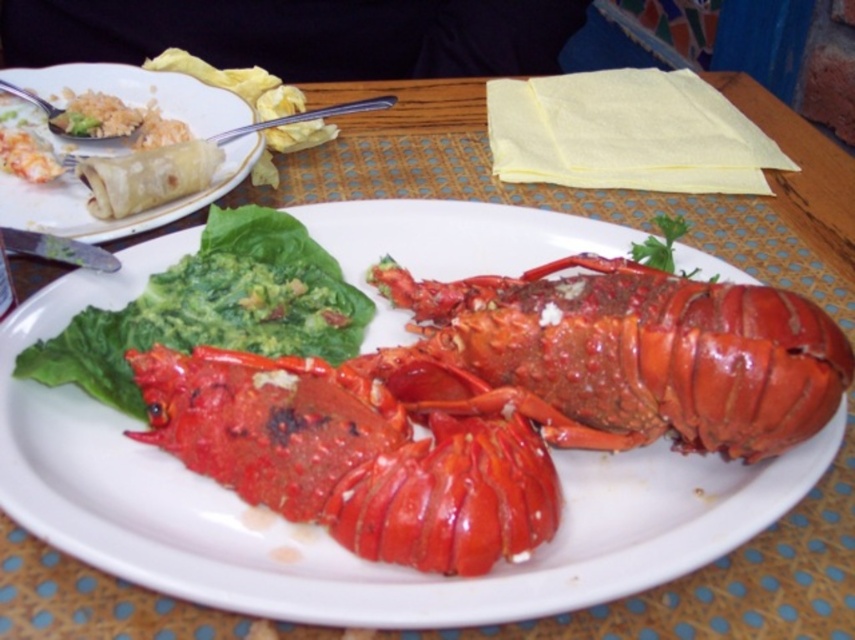
You are a food critic trying to determine if the shiny red lobster at center can fit on a plate that is the same size as the matte tortilla at left. Based on their sizes, what is your conclusion?

The shiny red lobster at center is wider than the matte tortilla at left, so it would not fit on a plate of the same size as the matte tortilla at left.

You are a food critic evaluating the presentation of this dish. Based on the height comparison between the shiny red lobster at center and the matte brown spring roll at upper left, which one appears taller?

The matte brown spring roll at upper left appears taller than the shiny red lobster at center.

You are a food delivery person who needs to place a lid over the shiny red lobster at center and the matte tortilla at left. The lid has a diameter of 25 centimeters. Will the lid cover both items completely?

The shiny red lobster at center and the matte tortilla at left are 20.69 centimeters apart from each other. Since the lid has a diameter of 25 centimeters, which is larger than the distance between them, the lid will cover both items completely.